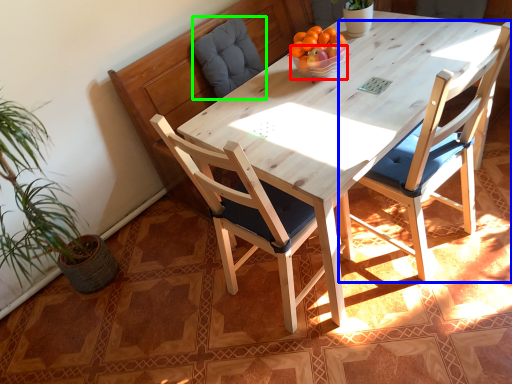
Question: Which object is positioned closest to bowl (highlighted by a red box)? Select from chair (highlighted by a blue box) and swivel chair (highlighted by a green box).

Choices:
 (A) chair
 (B) swivel chair

Answer: (A)